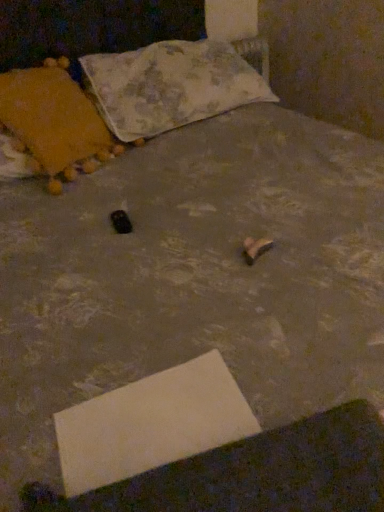
Question: Considering the positions of velvet orange pillow at left, acting as the 1th pillow starting from the left, and white cardboard at lower center in the image, is velvet orange pillow at left, acting as the 1th pillow starting from the left, taller or shorter than white cardboard at lower center?

Choices:
 (A) tall
 (B) short

Answer: (A)

Question: Considering the positions of velvet orange pillow at left, placed as the second pillow when sorted from right to left, and white cardboard at lower center in the image, is velvet orange pillow at left, placed as the second pillow when sorted from right to left, wider or thinner than white cardboard at lower center?

Choices:
 (A) thin
 (B) wide

Answer: (B)

Question: Which is farther from the velvet orange pillow at left, placed as the second pillow when sorted from right to left?

Choices:
 (A) white cardboard at lower center
 (B) fluffy fabric pillow at upper center, placed as the first pillow when sorted from right to left

Answer: (A)

Question: Which object is the closest to the white cardboard at lower center?

Choices:
 (A) fluffy fabric pillow at upper center, the second pillow from the left
 (B) velvet orange pillow at left, acting as the 1th pillow starting from the left

Answer: (B)